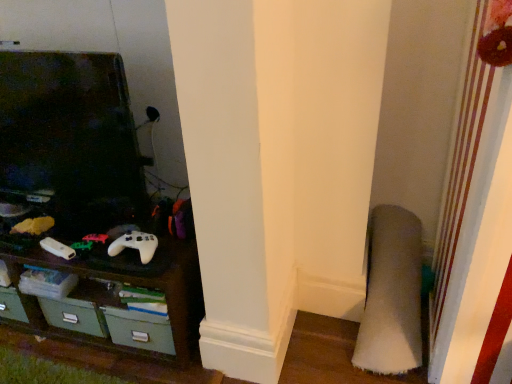
Question: Should I look upward or downward to see white matte game controller at center, which ranks as the 1th game controller in right-to-left order?

Choices:
 (A) up
 (B) down

Answer: (B)

Question: Can you confirm if soft gray carpet at lower right is wider than white matte game controller at lower left, the second game controller positioned from the right?

Choices:
 (A) no
 (B) yes

Answer: (B)

Question: From the image's perspective, is soft gray carpet at lower right located above white matte game controller at lower left, the second game controller positioned from the right?

Choices:
 (A) no
 (B) yes

Answer: (A)

Question: From the image's perspective, is soft gray carpet at lower right under white matte game controller at lower left, the second game controller positioned from the right?

Choices:
 (A) yes
 (B) no

Answer: (A)

Question: Can you confirm if soft gray carpet at lower right is shorter than white matte game controller at lower left, the second game controller positioned from the right?

Choices:
 (A) yes
 (B) no

Answer: (B)

Question: Is soft gray carpet at lower right not inside white matte game controller at lower left, the second game controller positioned from the right?

Choices:
 (A) yes
 (B) no

Answer: (A)

Question: Considering the relative positions of soft gray carpet at lower right and white matte game controller at lower left, arranged as the 1th game controller when viewed from the left, in the image provided, is soft gray carpet at lower right behind white matte game controller at lower left, arranged as the 1th game controller when viewed from the left,?

Choices:
 (A) no
 (B) yes

Answer: (A)

Question: Can you confirm if white matte game controller at lower left, the second game controller positioned from the right, is positioned to the left of white matte game controller at center, which ranks as the 1th game controller in right-to-left order?

Choices:
 (A) yes
 (B) no

Answer: (A)

Question: Is white matte game controller at lower left, arranged as the 1th game controller when viewed from the left, oriented towards white matte game controller at center, the second game controller from the left?

Choices:
 (A) yes
 (B) no

Answer: (B)

Question: Is white matte game controller at lower left, the second game controller positioned from the right, facing away from white matte game controller at center, which ranks as the 1th game controller in right-to-left order?

Choices:
 (A) yes
 (B) no

Answer: (B)

Question: Are white matte game controller at lower left, the second game controller positioned from the right, and white matte game controller at center, the second game controller from the left, located far from each other?

Choices:
 (A) no
 (B) yes

Answer: (A)

Question: Considering the relative sizes of white matte game controller at lower left, arranged as the 1th game controller when viewed from the left, and white matte game controller at center, which ranks as the 1th game controller in right-to-left order, in the image provided, is white matte game controller at lower left, arranged as the 1th game controller when viewed from the left, taller than white matte game controller at center, which ranks as the 1th game controller in right-to-left order,?

Choices:
 (A) yes
 (B) no

Answer: (B)

Question: Considering the relative sizes of white matte game controller at lower left, arranged as the 1th game controller when viewed from the left, and white matte game controller at center, which ranks as the 1th game controller in right-to-left order, in the image provided, is white matte game controller at lower left, arranged as the 1th game controller when viewed from the left, thinner than white matte game controller at center, which ranks as the 1th game controller in right-to-left order,?

Choices:
 (A) yes
 (B) no

Answer: (A)

Question: Considering the relative sizes of white matte game controller at lower left, arranged as the 1th game controller when viewed from the left, and dark wood shelf at lower left in the image provided, is white matte game controller at lower left, arranged as the 1th game controller when viewed from the left, smaller than dark wood shelf at lower left?

Choices:
 (A) no
 (B) yes

Answer: (B)